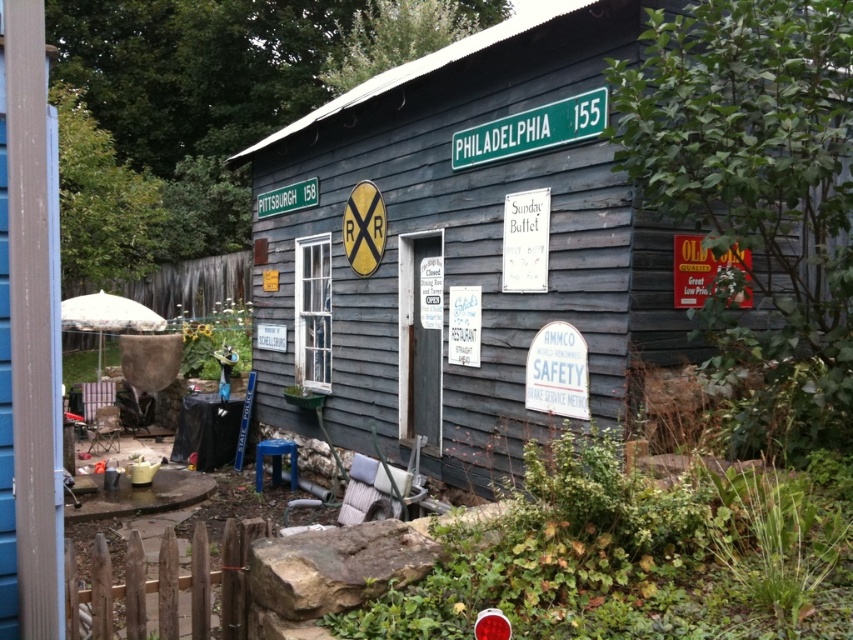
Is the position of weathered wood hut at center more distant than that of green plastic street sign at upper center?

That is False.

You are a GUI agent. You are given a task and a screenshot of the screen. Output one action in this format:
    pyautogui.click(x=<x>, y=<y>)
    Task: Click on the weathered wood hut at center
    Image resolution: width=853 pixels, height=640 pixels.
    Given the screenshot: What is the action you would take?
    pyautogui.click(x=460, y=250)